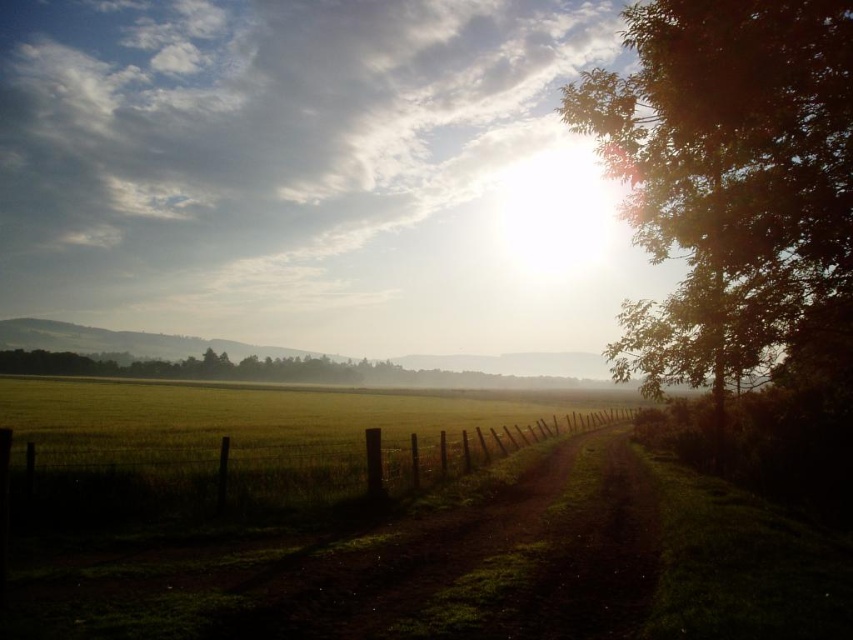
Can you confirm if green leafy tree at right is positioned below wooden fence at center?

Incorrect, green leafy tree at right is not positioned below wooden fence at center.

Is the position of green leafy tree at right more distant than that of wooden fence at center?

No.

Which is behind, point (735, 284) or point (392, 488)?

The point (735, 284) is more distant.

The image size is (853, 640). Find the location of `green leafy tree at right`. green leafy tree at right is located at coordinates (733, 186).

Between point (273, 445) and point (509, 432), which one is positioned in front?

Positioned in front is point (273, 445).

Can you confirm if green wooden fence at lower left is positioned below wooden fence at center?

No, green wooden fence at lower left is not below wooden fence at center.

Find the location of a particular element. green wooden fence at lower left is located at coordinates (258, 472).

Who is shorter, green leafy tree at right or green wooden fence at lower left?

green wooden fence at lower left

Is green leafy tree at right thinner than green wooden fence at lower left?

No, green leafy tree at right is not thinner than green wooden fence at lower left.

Between point (776, 180) and point (309, 481), which one is positioned behind?

Point (309, 481)

Image resolution: width=853 pixels, height=640 pixels. In order to click on green leafy tree at right in this screenshot , I will do `click(733, 186)`.